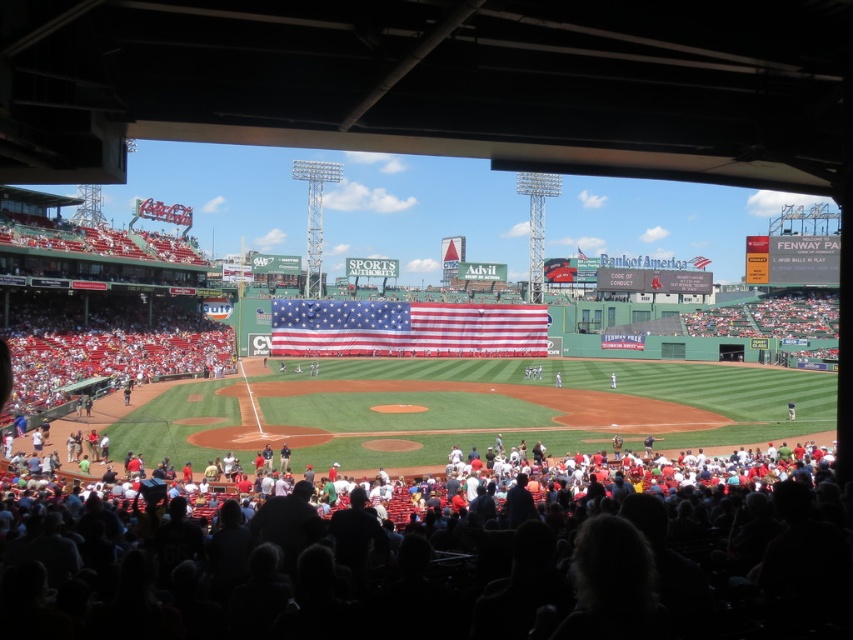
You are sitting in the stands at Fenway Park and notice two objects in your view. One is a person with dark hair at lower center and the other is the American flag at center. Which object appears taller from your seat?

The American flag at center appears taller than the dark hair at lower center because the dark hair at lower center is not as tall as the American flag at center.